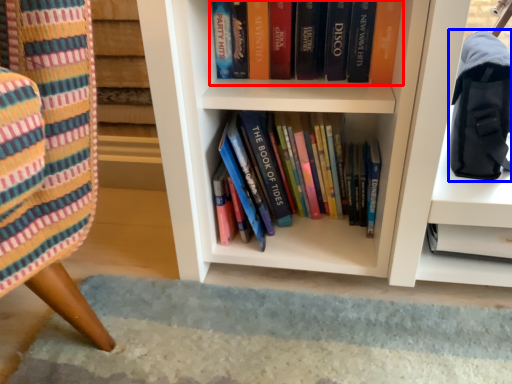
Question: Which of the following is the farthest to the observer, book (highlighted by a red box) or shoulder bag (highlighted by a blue box)?

Choices:
 (A) book
 (B) shoulder bag

Answer: (A)